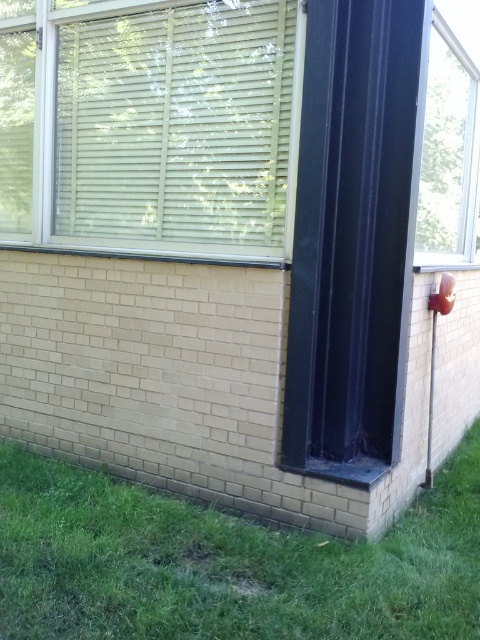
You are a window installer assessing the exterior wall. You notice the green grass at lower left and the clear glass window at upper right. Which object is shorter in height?

The green grass at lower left is not as tall as the clear glass window at upper right, so the green grass at lower left is shorter in height.

Based on the photo, you are standing at the base of the building and want to place a 7 feet long ladder against the wall. The ladder needs to reach both the green grass at lower left and the clear glass window at upper right. Is this possible?

The distance between the green grass at lower left and the clear glass window at upper right is 6.89 feet. Since the ladder is 7 feet long, it can just barely reach both points as the ladder length is slightly longer than the distance between them.

You are standing at the camera position and want to water the green grass at lower left. If your watering can has a range of 6 feet, will you be able to reach it without moving?

The green grass at lower left is 6.65 feet away from the camera, which is beyond the watering can range of 6 feet. You need to move closer to water it.